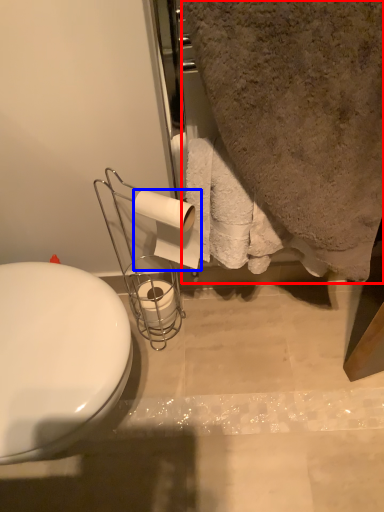
Question: Among these objects, which one is nearest to the camera, bath towel (highlighted by a red box) or toilet paper (highlighted by a blue box)?

Choices:
 (A) bath towel
 (B) toilet paper

Answer: (A)